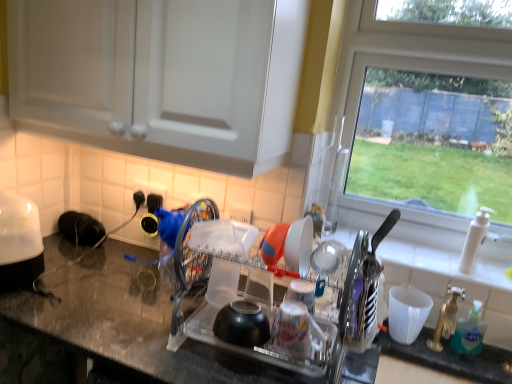
The image size is (512, 384). Identify the location of free point above granite black countertop at center (from a real-world perspective). (137, 303).